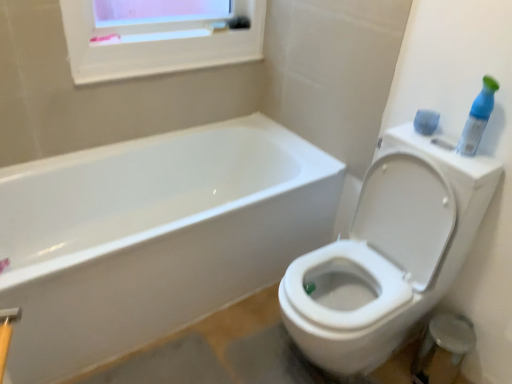
In order to face white glossy toilet at right, should I rotate leftwards or rightwards?

Rotate right and turn 14.761 degrees.

The height and width of the screenshot is (384, 512). Find the location of `white glossy toilet at right`. white glossy toilet at right is located at coordinates (389, 253).

The height and width of the screenshot is (384, 512). Describe the element at coordinates (389, 253) in the screenshot. I see `white glossy toilet at right` at that location.

Where is `blue plastic spray bottle at upper right`? blue plastic spray bottle at upper right is located at coordinates (478, 118).

The height and width of the screenshot is (384, 512). What do you see at coordinates (478, 118) in the screenshot?
I see `blue plastic spray bottle at upper right` at bounding box center [478, 118].

Measure the distance between point (467,145) and camera.

The depth of point (467,145) is 1.40 meters.

Where is `white glossy toilet at right`? This screenshot has height=384, width=512. white glossy toilet at right is located at coordinates (389, 253).

From the picture: Is blue plastic spray bottle at upper right at the right side of white glossy toilet at right?

Correct, you'll find blue plastic spray bottle at upper right to the right of white glossy toilet at right.

Considering the positions of objects blue plastic spray bottle at upper right and white glossy toilet at right in the image provided, who is behind, blue plastic spray bottle at upper right or white glossy toilet at right?

blue plastic spray bottle at upper right.

Between point (492, 110) and point (340, 260), which one is positioned behind?

Positioned behind is point (340, 260).

From the image's perspective, would you say blue plastic spray bottle at upper right is shown under white glossy toilet at right?

No, from the image's perspective, blue plastic spray bottle at upper right is not beneath white glossy toilet at right.

From a real-world perspective, which object stands above the other?

blue plastic spray bottle at upper right, from a real-world perspective.

Does blue plastic spray bottle at upper right have a greater width compared to white glossy toilet at right?

Incorrect, the width of blue plastic spray bottle at upper right does not surpass that of white glossy toilet at right.

Is blue plastic spray bottle at upper right taller than white glossy toilet at right?

Incorrect, the height of blue plastic spray bottle at upper right is not larger of that of white glossy toilet at right.

Looking at this image, does blue plastic spray bottle at upper right have a larger size compared to white glossy toilet at right?

Actually, blue plastic spray bottle at upper right might be smaller than white glossy toilet at right.

Is white glossy toilet at right inside blue plastic spray bottle at upper right?

That's incorrect, white glossy toilet at right is not inside blue plastic spray bottle at upper right.

Is blue plastic spray bottle at upper right not close to white glossy toilet at right?

No.

Is blue plastic spray bottle at upper right positioned with its back to white glossy toilet at right?

That's not correct — blue plastic spray bottle at upper right is not looking away from white glossy toilet at right.

You are a GUI agent. You are given a task and a screenshot of the screen. Output one action in this format:
    pyautogui.click(x=<x>, y=<y>)
    Task: Click on the cleaning product behind the white glossy toilet at right
    The width and height of the screenshot is (512, 384).
    Given the screenshot: What is the action you would take?
    pyautogui.click(x=478, y=118)

In the scene shown: Which is more to the left, white glossy toilet at right or blue plastic spray bottle at upper right?

white glossy toilet at right is more to the left.

Is white glossy toilet at right positioned before blue plastic spray bottle at upper right?

That is True.

Which is in front, point (404, 237) or point (489, 82)?

The point (489, 82) is in front.

From the image's perspective, is white glossy toilet at right over blue plastic spray bottle at upper right?

Incorrect, from the image's perspective, white glossy toilet at right is lower than blue plastic spray bottle at upper right.

From a real-world perspective, is white glossy toilet at right on top of blue plastic spray bottle at upper right?

No.

Does white glossy toilet at right have a greater width compared to blue plastic spray bottle at upper right?

Yes, white glossy toilet at right is wider than blue plastic spray bottle at upper right.

Considering the sizes of objects white glossy toilet at right and blue plastic spray bottle at upper right in the image provided, who is shorter, white glossy toilet at right or blue plastic spray bottle at upper right?

With less height is blue plastic spray bottle at upper right.

Does white glossy toilet at right have a larger size compared to blue plastic spray bottle at upper right?

Correct, white glossy toilet at right is larger in size than blue plastic spray bottle at upper right.

Would you say white glossy toilet at right is inside or outside blue plastic spray bottle at upper right?

white glossy toilet at right is outside blue plastic spray bottle at upper right.

Is white glossy toilet at right with blue plastic spray bottle at upper right?

No, white glossy toilet at right is not making contact with blue plastic spray bottle at upper right.

Looking at this image, does white glossy toilet at right turn towards blue plastic spray bottle at upper right?

No, white glossy toilet at right does not turn towards blue plastic spray bottle at upper right.

What's the angular difference between white glossy toilet at right and blue plastic spray bottle at upper right's facing directions?

3.96 degrees separate the facing orientations of white glossy toilet at right and blue plastic spray bottle at upper right.

How distant is white glossy toilet at right from blue plastic spray bottle at upper right?

white glossy toilet at right is 17.87 inches from blue plastic spray bottle at upper right.

Where is `cleaning product above the white glossy toilet at right (from a real-world perspective)`? cleaning product above the white glossy toilet at right (from a real-world perspective) is located at coordinates (478, 118).

Where is `toilet in front of the blue plastic spray bottle at upper right`? toilet in front of the blue plastic spray bottle at upper right is located at coordinates (389, 253).

Locate an element on the screen. cleaning product that is above the white glossy toilet at right (from a real-world perspective) is located at coordinates (478, 118).